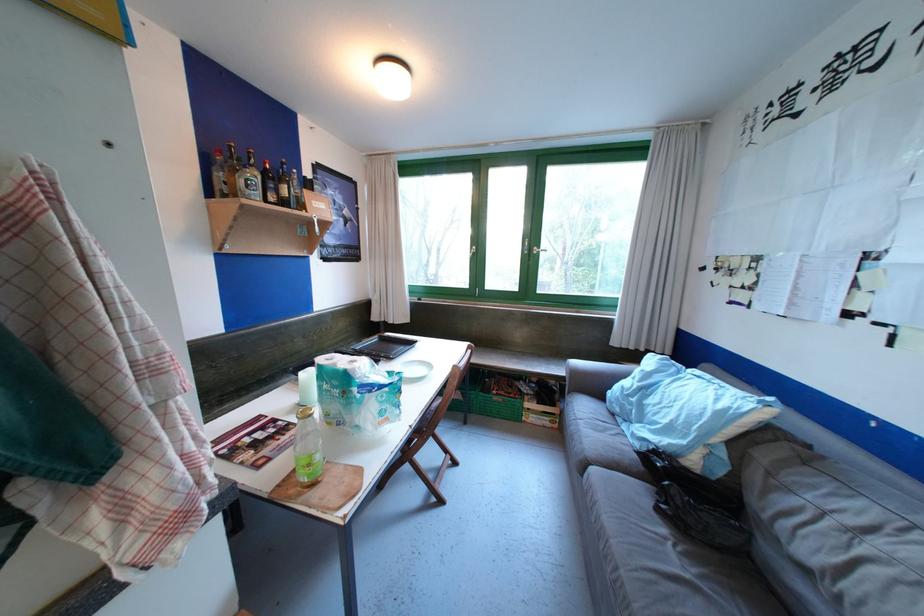
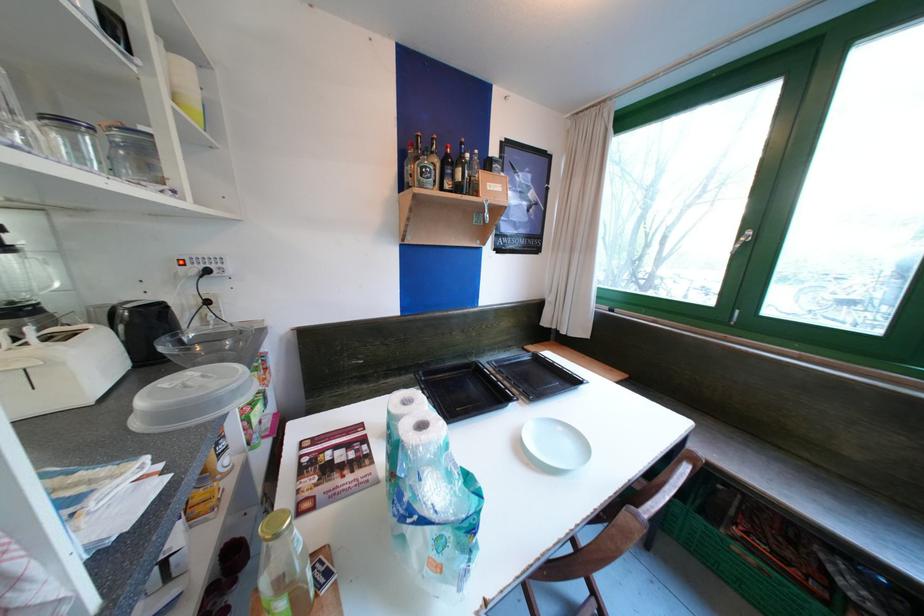
The point at (x=523, y=363) is marked in the first image. Where is the corresponding point in the second image?

(835, 503)